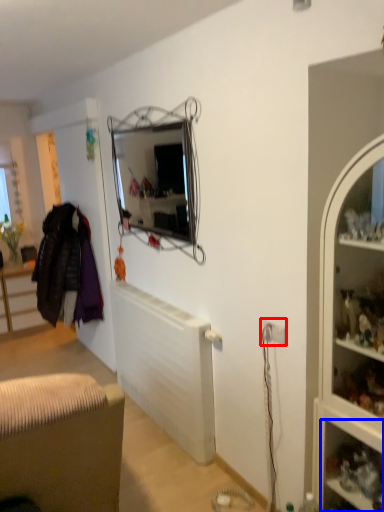
Question: Which object is further to the camera taking this photo, electric outlet (highlighted by a red box) or shelf (highlighted by a blue box)?

Choices:
 (A) electric outlet
 (B) shelf

Answer: (A)